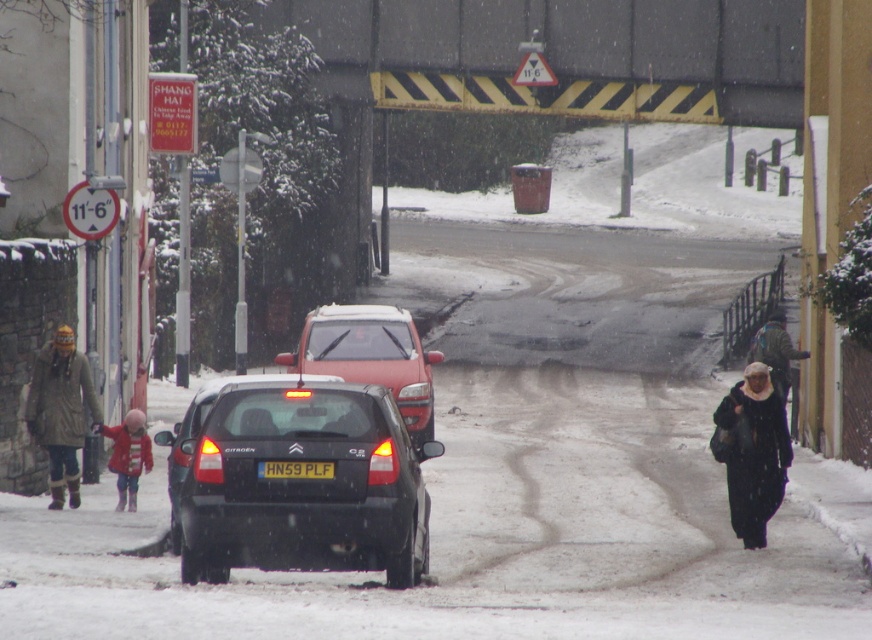
Who is more forward, (218, 449) or (777, 333)?

Point (218, 449)

Which is behind, point (222, 433) or point (787, 388)?

Positioned behind is point (787, 388).

Is point (328, 493) positioned in front of point (772, 324)?

Yes, point (328, 493) is in front of point (772, 324).

You are a GUI agent. You are given a task and a screenshot of the screen. Output one action in this format:
    pyautogui.click(x=<x>, y=<y>)
    Task: Click on the black matte car at center
    The height and width of the screenshot is (640, 872).
    Given the screenshot: What is the action you would take?
    pyautogui.click(x=303, y=483)

Between black matte car at center and green wool coat at left, which one is positioned higher?

green wool coat at left is above.

Measure the distance between point (x=322, y=404) and camera.

A distance of 15.02 meters exists between point (x=322, y=404) and camera.

Which is behind, point (353, 554) or point (69, 403)?

Positioned behind is point (69, 403).

Where is `black matte car at center`? This screenshot has height=640, width=872. black matte car at center is located at coordinates (303, 483).

The image size is (872, 640). What do you see at coordinates (370, 356) in the screenshot?
I see `matte red van at center` at bounding box center [370, 356].

From the picture: Does matte red van at center have a larger size compared to yellow matte license plate at center?

Correct, matte red van at center is larger in size than yellow matte license plate at center.

Does point (410, 380) come in front of point (296, 477)?

No, it is behind (296, 477).

Image resolution: width=872 pixels, height=640 pixels. Identify the location of matte red van at center. (370, 356).